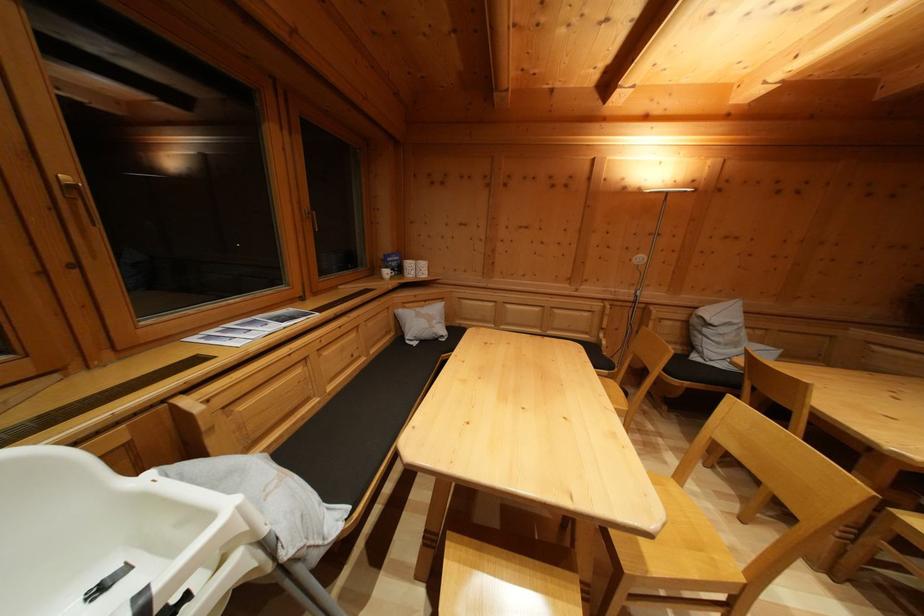
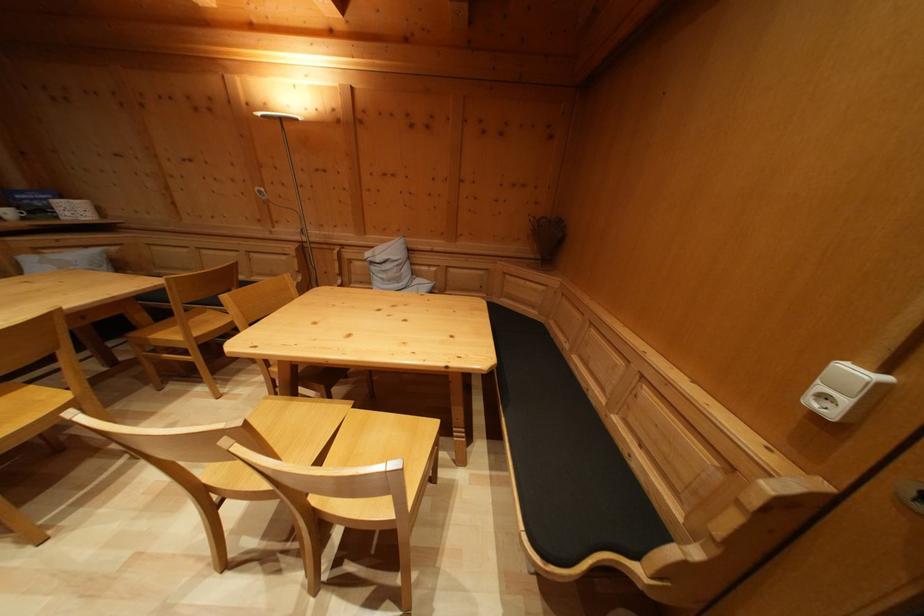
Locate, in the second image, the point that corresponds to point 393,280 in the first image.

(14, 219)